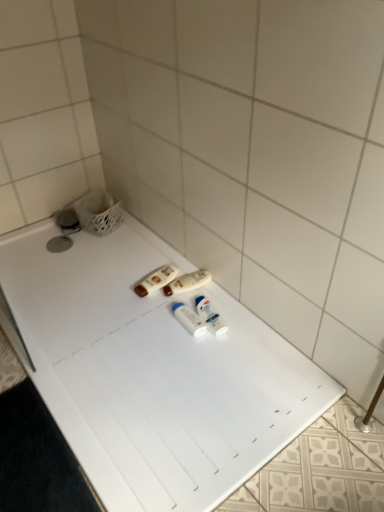
Question: Which direction should I rotate to look at white plastic deodorant at center, marked as the fourth toiletry in a left-to-right arrangement, — up or down?

Choices:
 (A) up
 (B) down

Answer: (B)

Question: Is white plastic bottles at center, acting as the second toiletry starting from the right, shorter than brown plastic lotion at center, positioned as the 4th toiletry in right-to-left order?

Choices:
 (A) no
 (B) yes

Answer: (A)

Question: Is white plastic bottles at center, the 3th toiletry when ordered from left to right, completely or partially outside of brown plastic lotion at center, positioned as the 4th toiletry in right-to-left order?

Choices:
 (A) yes
 (B) no

Answer: (A)

Question: Is white plastic bottles at center, acting as the second toiletry starting from the right, taller than brown plastic lotion at center, positioned as the 4th toiletry in right-to-left order?

Choices:
 (A) no
 (B) yes

Answer: (B)

Question: Can you confirm if white plastic bottles at center, the 3th toiletry when ordered from left to right, is wider than brown plastic lotion at center, the first toiletry in the left-to-right sequence?

Choices:
 (A) no
 (B) yes

Answer: (A)

Question: Is white plastic bottles at center, acting as the second toiletry starting from the right, far from brown plastic lotion at center, the first toiletry in the left-to-right sequence?

Choices:
 (A) yes
 (B) no

Answer: (B)

Question: Is white plastic bottles at center, the 3th toiletry when ordered from left to right, further to camera compared to brown plastic lotion at center, the first toiletry in the left-to-right sequence?

Choices:
 (A) no
 (B) yes

Answer: (A)

Question: Is brown plastic lotion at center, positioned as the 4th toiletry in right-to-left order, positioned with its back to white plastic bottles at center, the second toiletry positioned from the left?

Choices:
 (A) no
 (B) yes

Answer: (A)

Question: Are brown plastic lotion at center, positioned as the 4th toiletry in right-to-left order, and white plastic bottles at center, which is the third toiletry in right-to-left order, beside each other?

Choices:
 (A) no
 (B) yes

Answer: (B)

Question: Is brown plastic lotion at center, positioned as the 4th toiletry in right-to-left order, shorter than white plastic bottles at center, which is the third toiletry in right-to-left order?

Choices:
 (A) no
 (B) yes

Answer: (B)

Question: Considering the relative sizes of brown plastic lotion at center, the first toiletry in the left-to-right sequence, and white plastic bottles at center, which is the third toiletry in right-to-left order, in the image provided, is brown plastic lotion at center, the first toiletry in the left-to-right sequence, bigger than white plastic bottles at center, which is the third toiletry in right-to-left order,?

Choices:
 (A) no
 (B) yes

Answer: (A)

Question: Considering the relative positions of brown plastic lotion at center, positioned as the 4th toiletry in right-to-left order, and white plastic bottles at center, the second toiletry positioned from the left, in the image provided, is brown plastic lotion at center, positioned as the 4th toiletry in right-to-left order, to the right of white plastic bottles at center, the second toiletry positioned from the left, from the viewer's perspective?

Choices:
 (A) no
 (B) yes

Answer: (A)

Question: From a real-world perspective, is brown plastic lotion at center, positioned as the 4th toiletry in right-to-left order, located higher than white plastic bottles at center, which is the third toiletry in right-to-left order?

Choices:
 (A) yes
 (B) no

Answer: (B)

Question: Could you tell me if white plastic bottles at center, acting as the second toiletry starting from the right, is facing white plastic bottles at center, which is the third toiletry in right-to-left order?

Choices:
 (A) yes
 (B) no

Answer: (B)